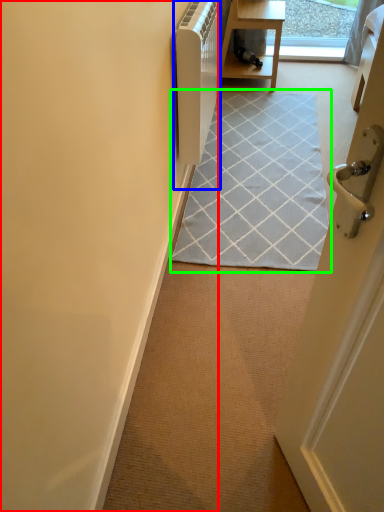
Question: Which object is positioned farthest from door (highlighted by a red box)? Select from appliance (highlighted by a blue box) and doormat (highlighted by a green box).

Choices:
 (A) appliance
 (B) doormat

Answer: (B)